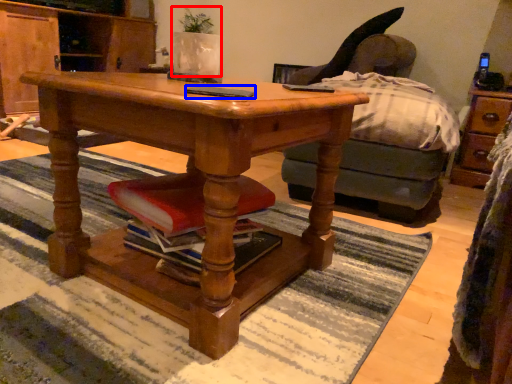
Question: Which point is closer to the camera, houseplant (highlighted by a red box) or mobile phone (highlighted by a blue box)?

Choices:
 (A) houseplant
 (B) mobile phone

Answer: (B)